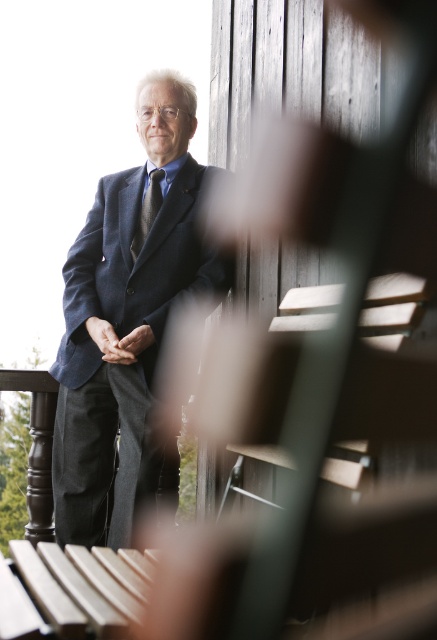
Looking at this image, you are an architect designing a new balcony and want to place a bench where the dark blue suit at center is located at point [128,326]. Can you confirm the exact coordinates of this point?

The dark blue suit at center is located at point [128,326].

You are a fashion designer observing the man in the scene. You need to determine the order of the dark blue suit at center and dark gray textured tie at center from top to bottom. Which one is located lower?

The dark blue suit at center is positioned under the dark gray textured tie at center, so the dark blue suit at center is located lower than the dark gray textured tie at center.